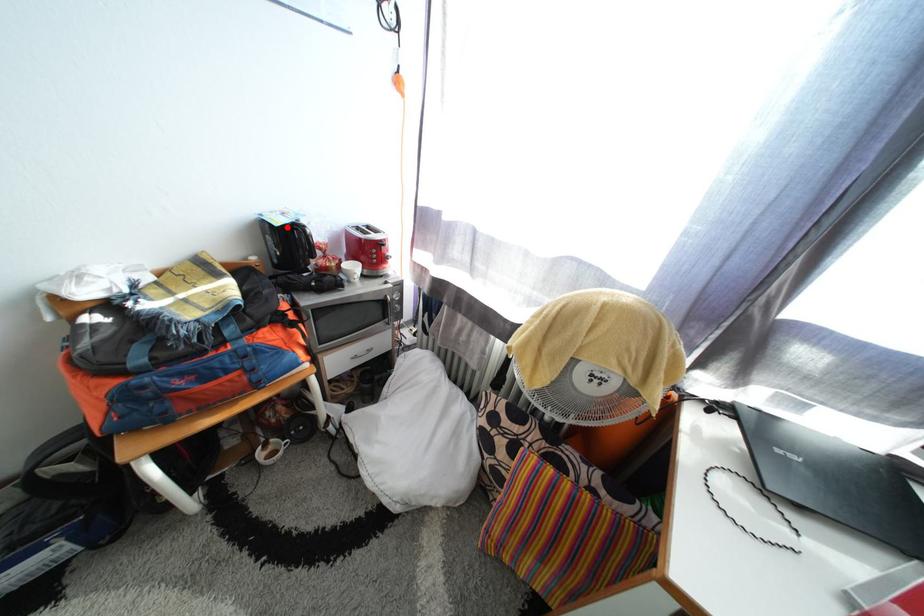
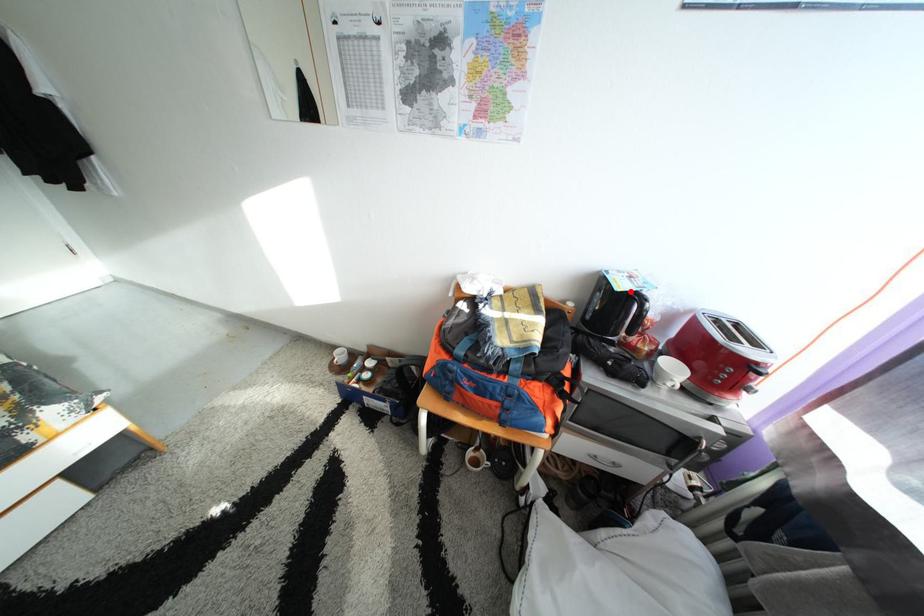
Looking at this image, I am providing you with two images of the same scene from different viewpoints. A red point is marked on the first image and another point is marked on the second image. Are the points marked in image1 and image2 representing the same 3D position?

Yes